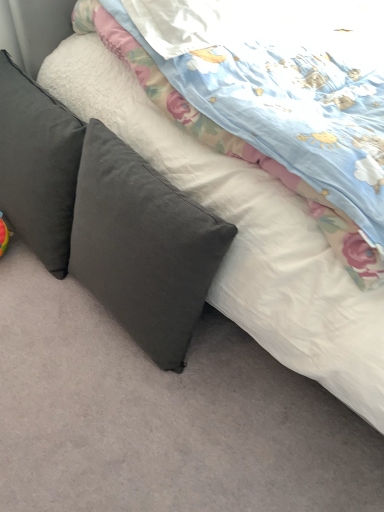
The height and width of the screenshot is (512, 384). In order to click on vacant space to the left of dark gray fabric pillow at left, the 2th pillow viewed from the left in this screenshot , I will do `click(41, 319)`.